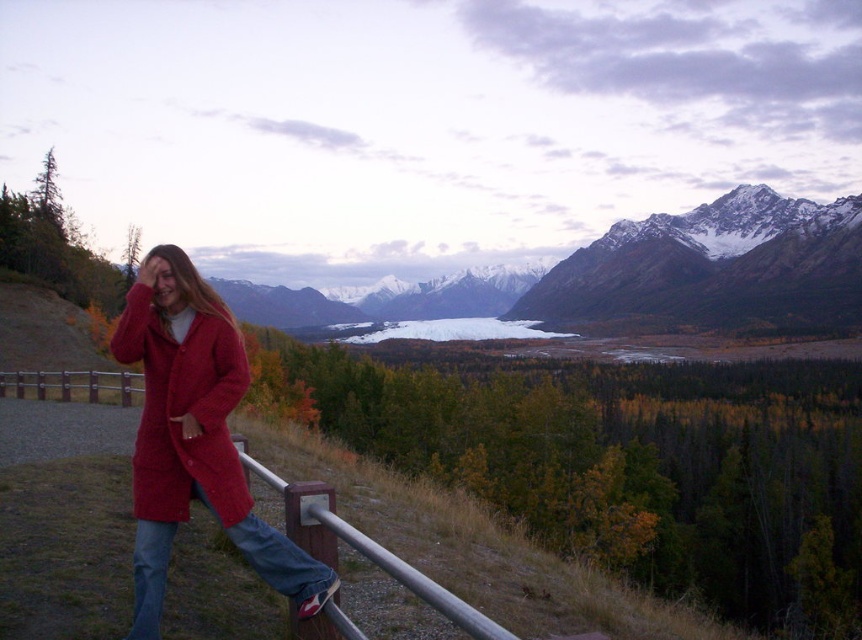
You are a photographer trying to capture a clear shot of the matte red coat at left and the brushed metal rail at lower center. Since the rail is behind the coat, will it be visible in the photo?

The brushed metal rail at lower center is behind the matte red coat at left, so it may not be fully visible in the photo unless the coat is moved or the angle is adjusted.

You are a photographer trying to capture a clear shot of both the matte red coat at center and the matte red coat at left. Which one will appear larger in your photo?

The matte red coat at center will appear larger in the photo because it is closer to the viewer than the matte red coat at left.

You are a fashion designer observing the scene. You notice two matte red coats in the image. How far apart are the matte red coat at center and the matte red coat at left?

The matte red coat at center is 1.51 meters from the matte red coat at left.